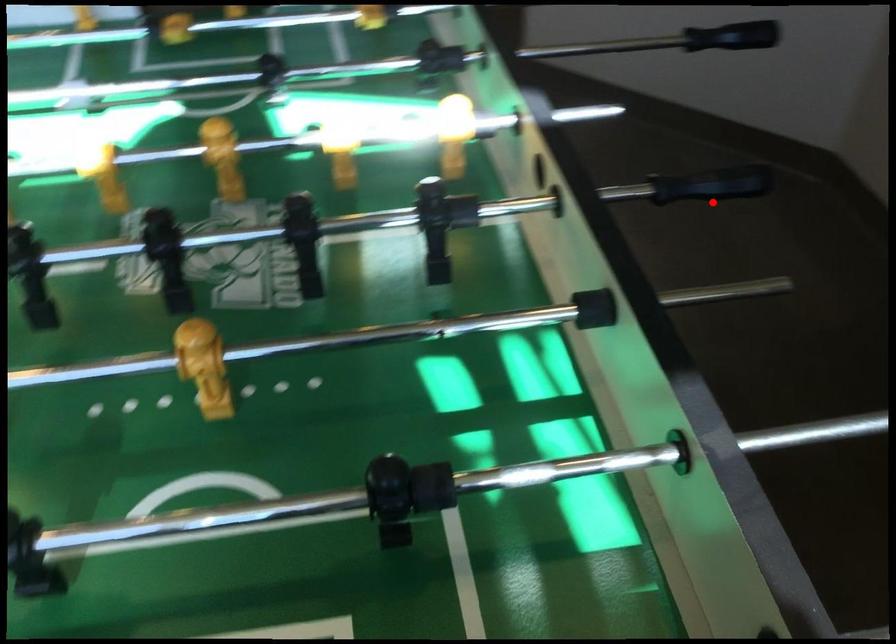
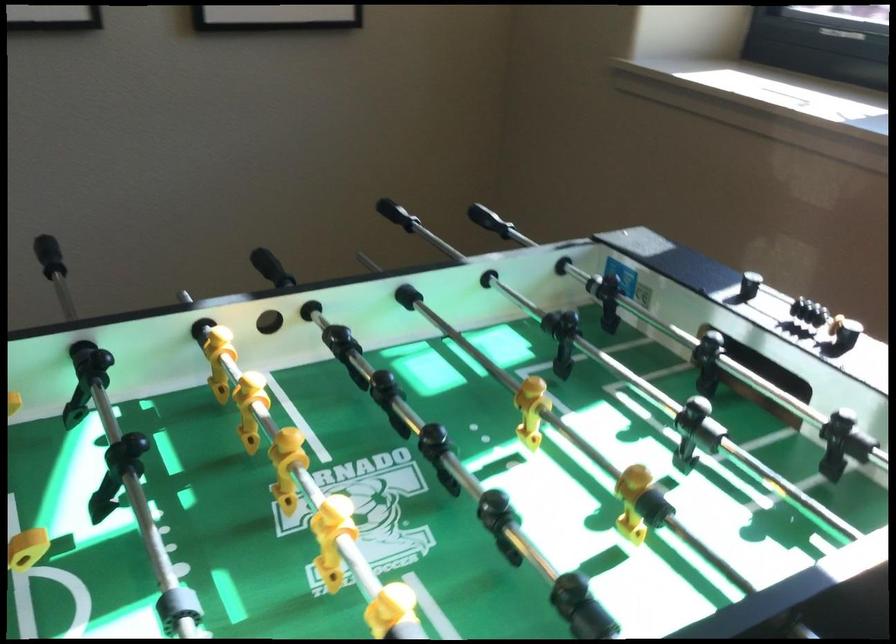
Question: I am providing you with two images of the same scene from different viewpoints. Given a red point in image1, look at the same physical point in image2. Is it:

Choices:
 (A) Closer to the viewpoint
 (B) Farther from the viewpoint

Answer: (B)